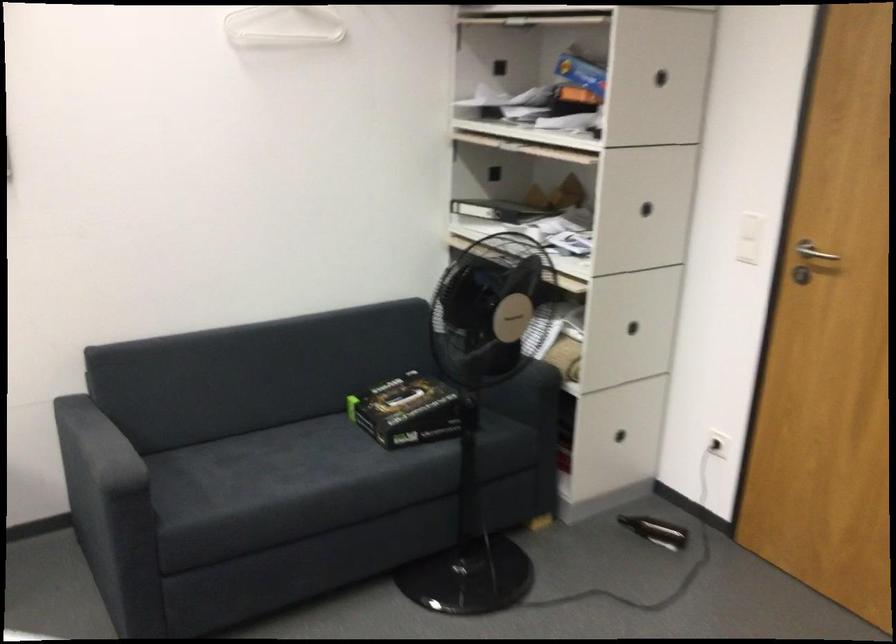
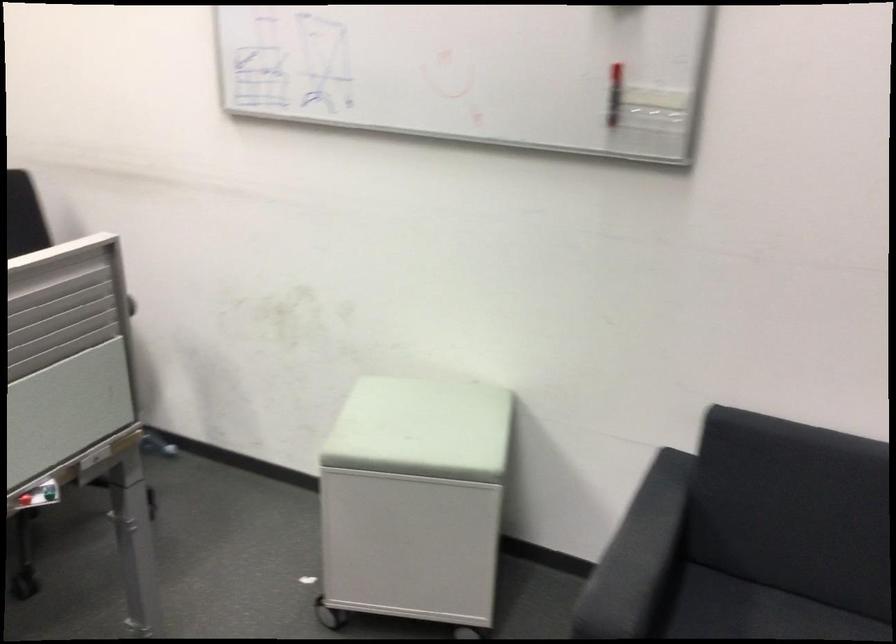
Question: The images are taken continuously from a first-person perspective. In which direction is your viewpoint rotating?

Choices:
 (A) Left
 (B) Right
 (C) Up
 (D) Down

Answer: (A)